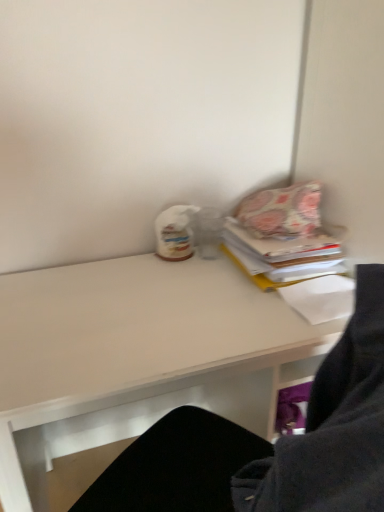
Image resolution: width=384 pixels, height=512 pixels. Describe the element at coordinates (283, 257) in the screenshot. I see `patterned fabric book at upper right` at that location.

This screenshot has height=512, width=384. Describe the element at coordinates (130, 351) in the screenshot. I see `white matte desk at center` at that location.

Where is `floral fabric pillow at upper right`? The width and height of the screenshot is (384, 512). floral fabric pillow at upper right is located at coordinates (282, 211).

Considering the sizes of objects white matte desk at center and patterned fabric book at upper right in the image provided, who is thinner, white matte desk at center or patterned fabric book at upper right?

Thinner between the two is patterned fabric book at upper right.

Is white matte desk at center far from patterned fabric book at upper right?

They are positioned close to each other.

From the image's perspective, between white matte desk at center and patterned fabric book at upper right, which one is located above?

From the image's view, patterned fabric book at upper right is above.

I want to click on pillow behind the patterned fabric book at upper right, so click(x=282, y=211).

Is floral fabric pillow at upper right positioned with its back to patterned fabric book at upper right?

That's not correct — floral fabric pillow at upper right is not looking away from patterned fabric book at upper right.

Looking at this image, is floral fabric pillow at upper right surrounding patterned fabric book at upper right?

Actually, patterned fabric book at upper right is outside floral fabric pillow at upper right.

Is floral fabric pillow at upper right in contact with patterned fabric book at upper right?

Yes, floral fabric pillow at upper right is right next to patterned fabric book at upper right and making contact.

Is white matte desk at center oriented towards floral fabric pillow at upper right?

No.

Is white matte desk at center not close to floral fabric pillow at upper right?

No, white matte desk at center is in close proximity to floral fabric pillow at upper right.

Considering the sizes of objects white matte desk at center and floral fabric pillow at upper right in the image provided, who is thinner, white matte desk at center or floral fabric pillow at upper right?

Thinner between the two is floral fabric pillow at upper right.

In the image, is white matte desk at center positioned in front of or behind floral fabric pillow at upper right?

Clearly, white matte desk at center is in front of floral fabric pillow at upper right.

Considering the sizes of objects patterned fabric book at upper right and floral fabric pillow at upper right in the image provided, who is taller, patterned fabric book at upper right or floral fabric pillow at upper right?

With more height is floral fabric pillow at upper right.

Between patterned fabric book at upper right and floral fabric pillow at upper right, which one has smaller size?

floral fabric pillow at upper right is smaller.

Is patterned fabric book at upper right inside the boundaries of floral fabric pillow at upper right, or outside?

patterned fabric book at upper right cannot be found inside floral fabric pillow at upper right.

Based on the photo, between patterned fabric book at upper right and floral fabric pillow at upper right, which one is positioned behind?

floral fabric pillow at upper right.

Which object is closer to the camera taking this photo, patterned fabric book at upper right or white matte desk at center?

white matte desk at center is more forward.

Is white matte desk at center at the back of patterned fabric book at upper right?

patterned fabric book at upper right is not turned away from white matte desk at center.

Which object is positioned more to the right, patterned fabric book at upper right or white matte desk at center?

Positioned to the right is patterned fabric book at upper right.

Considering the sizes of objects patterned fabric book at upper right and white matte desk at center in the image provided, who is thinner, patterned fabric book at upper right or white matte desk at center?

With smaller width is patterned fabric book at upper right.

Is floral fabric pillow at upper right next to white matte desk at center?

floral fabric pillow at upper right and white matte desk at center are not in contact.

Who is shorter, floral fabric pillow at upper right or white matte desk at center?

floral fabric pillow at upper right is shorter.

What's the angular difference between floral fabric pillow at upper right and white matte desk at center's facing directions?

They differ by 3.73 degrees in their facing directions.

From a real-world perspective, which is physically above, floral fabric pillow at upper right or white matte desk at center?

From a 3D spatial view, floral fabric pillow at upper right is above.

The image size is (384, 512). What are the coordinates of `paperback book lying behind the white matte desk at center` in the screenshot? It's located at (283, 257).

Locate an element on the screen. The width and height of the screenshot is (384, 512). paperback book that appears below the floral fabric pillow at upper right (from a real-world perspective) is located at coordinates (283, 257).

Estimate the real-world distances between objects in this image. Which object is further from white matte desk at center, patterned fabric book at upper right or floral fabric pillow at upper right?

Among the two, floral fabric pillow at upper right is located further to white matte desk at center.

Which object lies nearer to the anchor point floral fabric pillow at upper right, white matte desk at center or patterned fabric book at upper right?

patterned fabric book at upper right.

Which object lies nearer to the anchor point floral fabric pillow at upper right, patterned fabric book at upper right or white matte desk at center?

Based on the image, patterned fabric book at upper right appears to be nearer to floral fabric pillow at upper right.

Based on their spatial positions, is floral fabric pillow at upper right or white matte desk at center further from patterned fabric book at upper right?

white matte desk at center lies further to patterned fabric book at upper right than the other object.

Estimate the real-world distances between objects in this image. Which object is further from patterned fabric book at upper right, white matte desk at center or floral fabric pillow at upper right?

Among the two, white matte desk at center is located further to patterned fabric book at upper right.

Estimate the real-world distances between objects in this image. Which object is closer to white matte desk at center, floral fabric pillow at upper right or patterned fabric book at upper right?

patterned fabric book at upper right.

The width and height of the screenshot is (384, 512). In order to click on paperback book between floral fabric pillow at upper right and white matte desk at center in the vertical direction in this screenshot , I will do `click(283, 257)`.